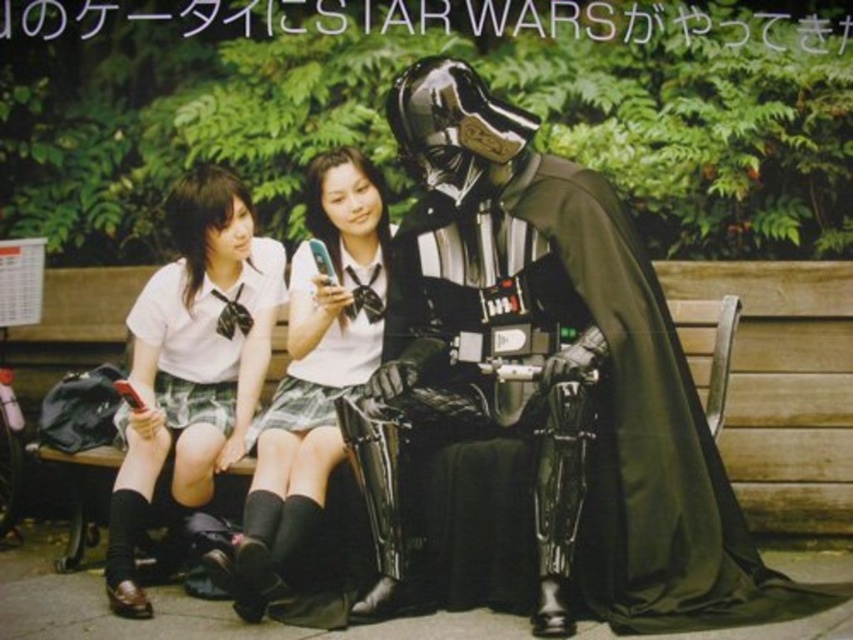
Is white glossy uniform at center closer to camera compared to white fabric skirt at center?

No, white glossy uniform at center is further to the viewer.

Which is above, white glossy uniform at center or white fabric skirt at center?

white fabric skirt at center is higher up.

Find the location of a particular element. Image resolution: width=853 pixels, height=640 pixels. white glossy uniform at center is located at coordinates [192, 362].